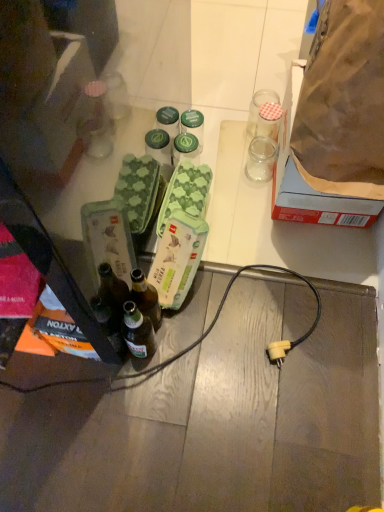
Question: From the image's perspective, is green matte jar at center over brown paper bag at upper right?

Choices:
 (A) no
 (B) yes

Answer: (B)

Question: Can you confirm if green matte jar at center is taller than brown paper bag at upper right?

Choices:
 (A) yes
 (B) no

Answer: (B)

Question: Does green matte jar at center contain brown paper bag at upper right?

Choices:
 (A) yes
 (B) no

Answer: (B)

Question: Is green matte jar at center closer to the viewer compared to brown paper bag at upper right?

Choices:
 (A) no
 (B) yes

Answer: (A)

Question: Is green matte jar at center thinner than brown paper bag at upper right?

Choices:
 (A) yes
 (B) no

Answer: (A)

Question: Choose the correct answer: Is green cardboard egg carton at center inside brown paper bag at upper right or outside it?

Choices:
 (A) inside
 (B) outside

Answer: (B)

Question: Looking at the image, does green cardboard egg carton at center seem bigger or smaller compared to brown paper bag at upper right?

Choices:
 (A) small
 (B) big

Answer: (A)

Question: From the image's perspective, is green cardboard egg carton at center positioned above or below brown paper bag at upper right?

Choices:
 (A) below
 (B) above

Answer: (A)

Question: In terms of height, does green cardboard egg carton at center look taller or shorter compared to brown paper bag at upper right?

Choices:
 (A) short
 (B) tall

Answer: (A)

Question: From a real-world perspective, is brown paper bag at upper right physically located above or below green cardboard egg carton at center?

Choices:
 (A) below
 (B) above

Answer: (B)

Question: Choose the correct answer: Is brown paper bag at upper right inside green cardboard egg carton at center or outside it?

Choices:
 (A) outside
 (B) inside

Answer: (A)

Question: Considering the positions of brown paper bag at upper right and green cardboard egg carton at center in the image, is brown paper bag at upper right bigger or smaller than green cardboard egg carton at center?

Choices:
 (A) small
 (B) big

Answer: (B)

Question: Considering the positions of brown paper bag at upper right and green cardboard egg carton at center in the image, is brown paper bag at upper right wider or thinner than green cardboard egg carton at center?

Choices:
 (A) wide
 (B) thin

Answer: (A)

Question: Is green matte jar at center wider or thinner than brown paper bag at upper right?

Choices:
 (A) wide
 (B) thin

Answer: (B)

Question: From a real-world perspective, is green matte jar at center above or below brown paper bag at upper right?

Choices:
 (A) above
 (B) below

Answer: (B)